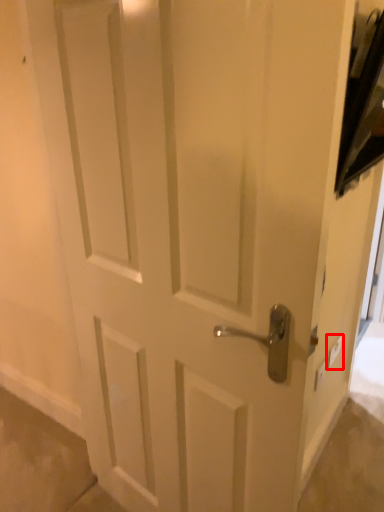
Question: Where is light switch (annotated by the red box) located in relation to light switch in the image?

Choices:
 (A) left
 (B) right

Answer: (B)